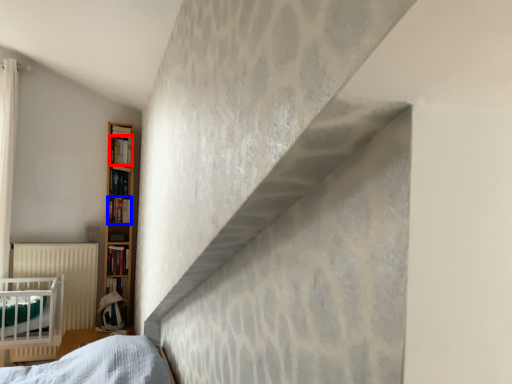
Question: Which object appears closest to the camera in this image, book (highlighted by a red box) or book (highlighted by a blue box)?

Choices:
 (A) book
 (B) book

Answer: (A)